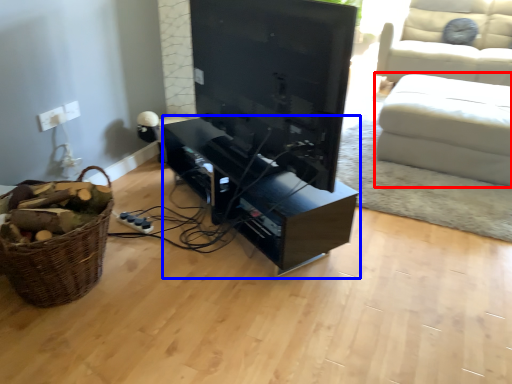
Question: Which object appears closest to the camera in this image, studio couch (highlighted by a red box) or entertainment center (highlighted by a blue box)?

Choices:
 (A) studio couch
 (B) entertainment center

Answer: (B)